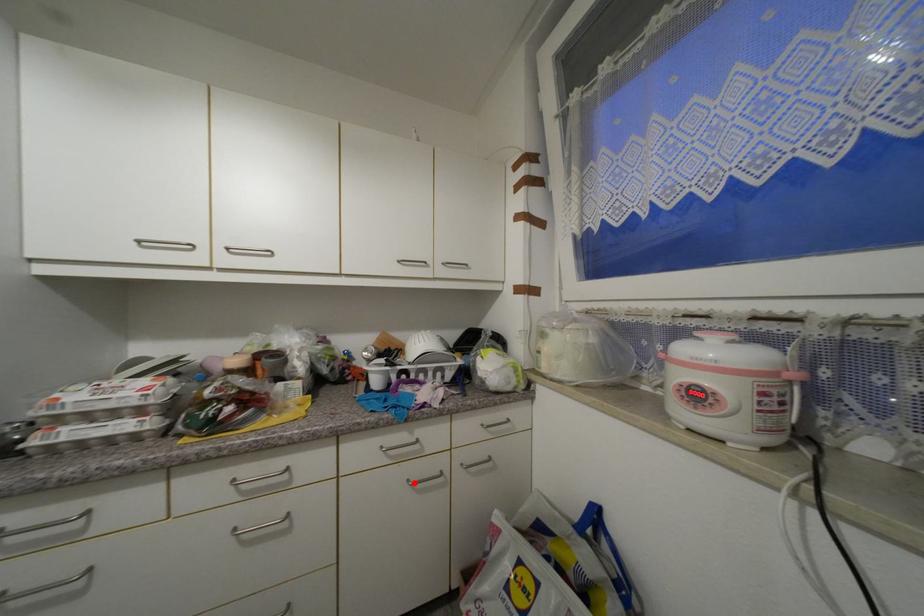
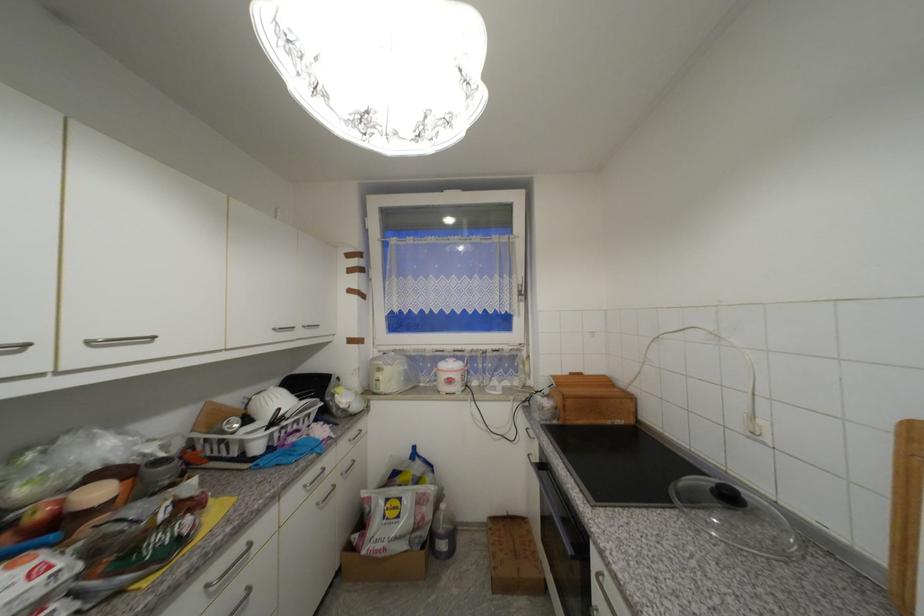
Where in the second image is the point corresponding to the highlighted location from the first image?

(322, 505)